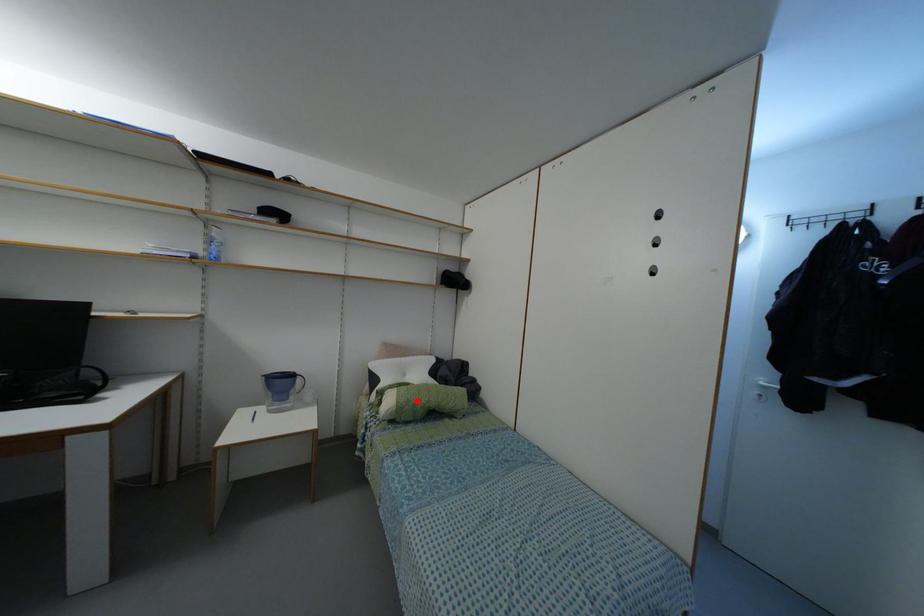
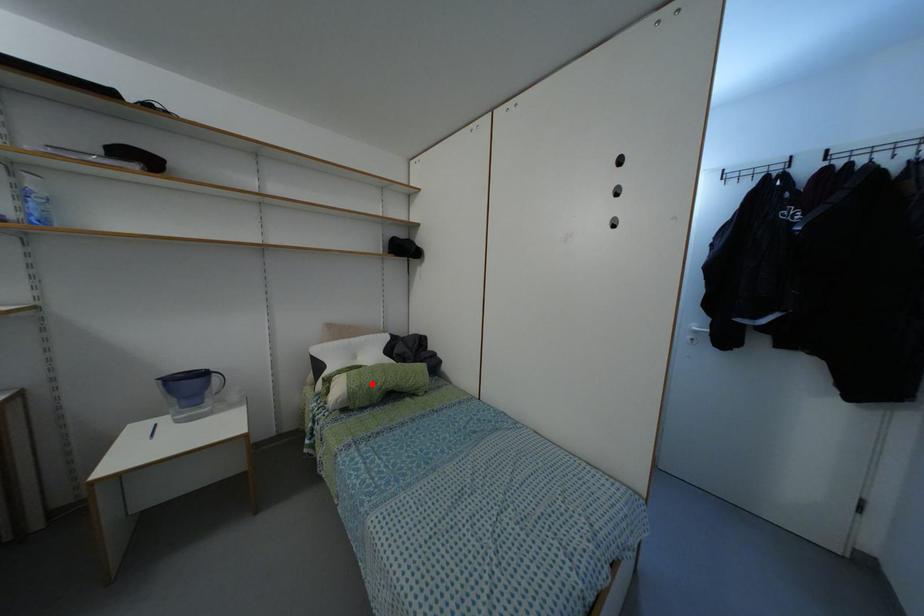
I am providing you with two images of the same scene from different viewpoints. A red point is marked on the first image and another point is marked on the second image. Are the points marked in image1 and image2 representing the same 3D position?

Yes